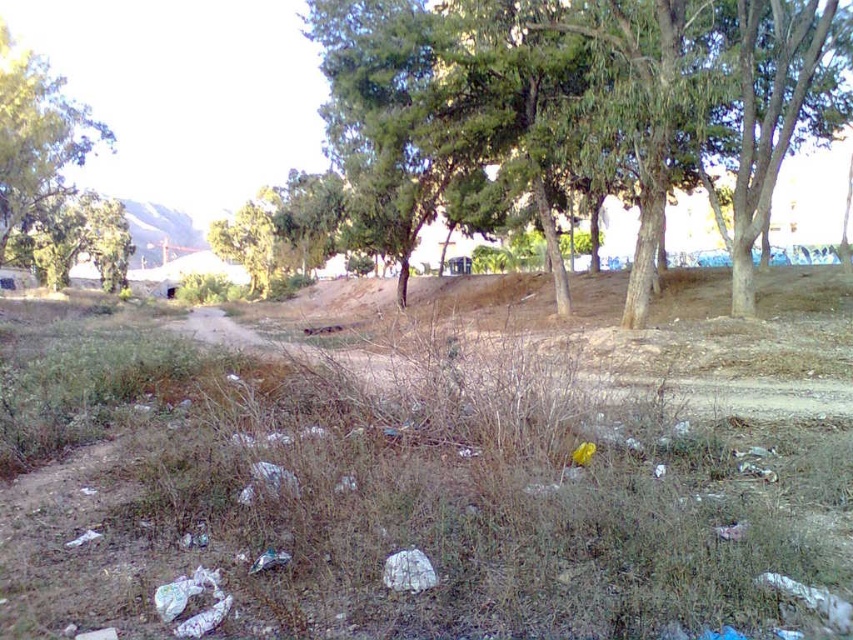
Question: Which point is closer to the camera taking this photo?

Choices:
 (A) (721, 129)
 (B) (49, 186)
 (C) (219, 320)

Answer: (A)

Question: Which of the following is the farthest from the observer?

Choices:
 (A) green leafy tree at center
 (B) green leafy tree at upper left

Answer: (B)

Question: Which point is farther to the camera?

Choices:
 (A) brown grassy dirt field at center
 (B) green leafy tree at center

Answer: (B)

Question: Is brown grassy dirt field at center further to the viewer compared to green leafy tree at upper left?

Choices:
 (A) yes
 (B) no

Answer: (B)

Question: Can you confirm if brown grassy dirt field at center is positioned to the left of green leafy tree at center?

Choices:
 (A) yes
 (B) no

Answer: (B)

Question: Is green leafy tree at center positioned before green leafy tree at upper left?

Choices:
 (A) yes
 (B) no

Answer: (A)